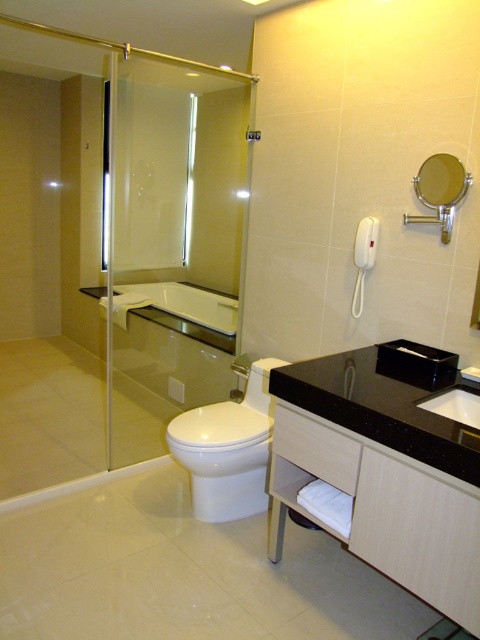
Question: Which is farther from the white glossy toilet at center?

Choices:
 (A) transparent glass shower door at left
 (B) black granite sink at center
 (C) silver metallic faucet at lower center
 (D) black marble vanity at lower right

Answer: (C)

Question: Which point appears closest to the camera in this image?

Choices:
 (A) (472, 426)
 (B) (228, 298)
 (C) (204, 506)

Answer: (A)

Question: Which point appears closest to the camera in this image?

Choices:
 (A) (236, 301)
 (B) (280, 413)
 (C) (458, 401)
 (D) (82, 204)

Answer: (C)

Question: Is the position of transparent glass shower door at left less distant than that of white glossy toilet at center?

Choices:
 (A) yes
 (B) no

Answer: (A)

Question: Does transparent glass shower door at left have a lesser width compared to white glossy toilet at center?

Choices:
 (A) yes
 (B) no

Answer: (B)

Question: Does transparent glass shower door at left come behind black marble vanity at lower right?

Choices:
 (A) no
 (B) yes

Answer: (B)